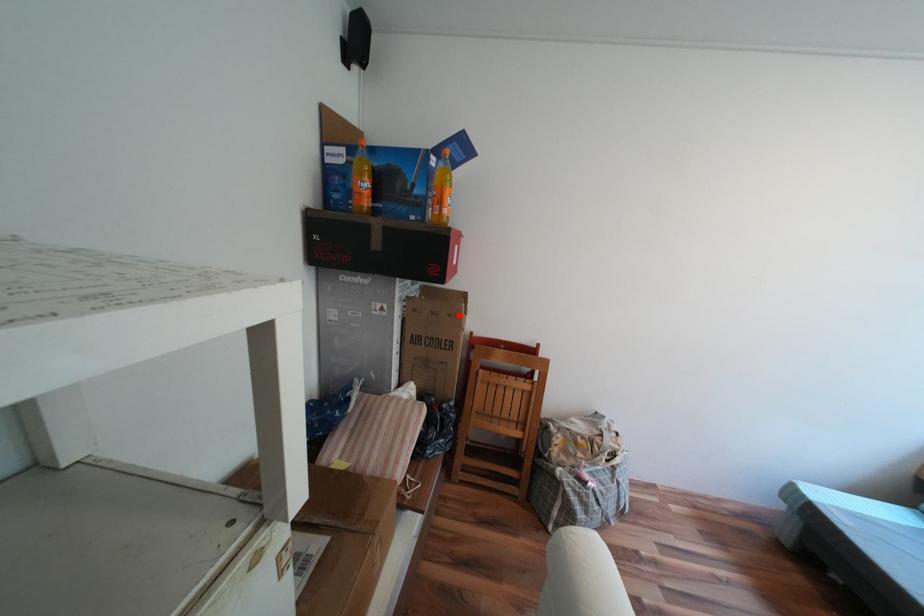
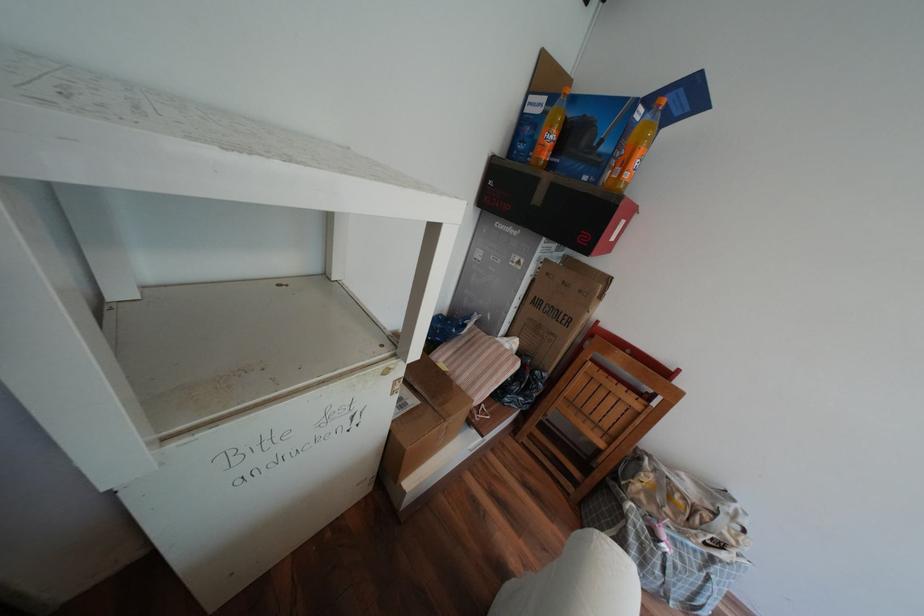
The point at the highlighted location is marked in the first image. Where is the corresponding point in the second image?

(590, 291)